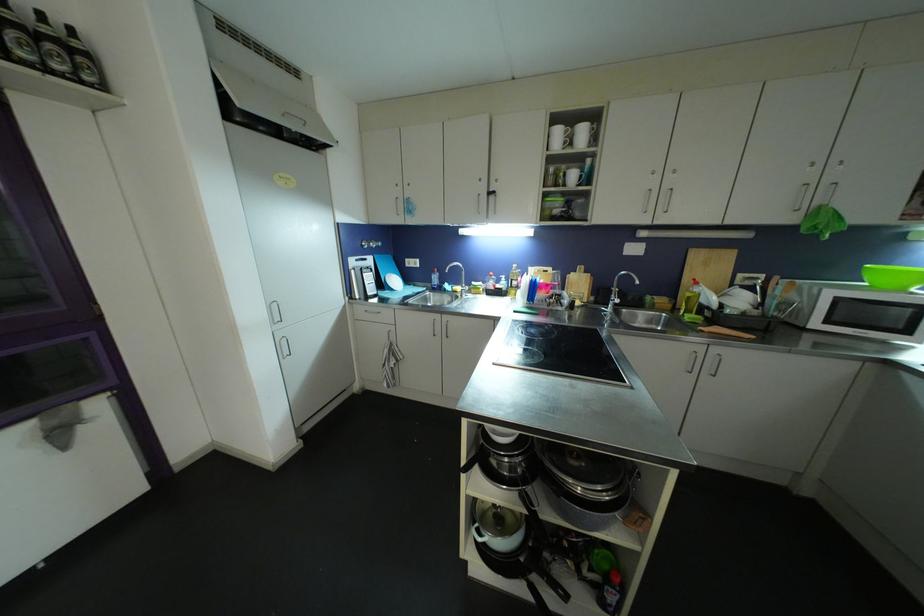
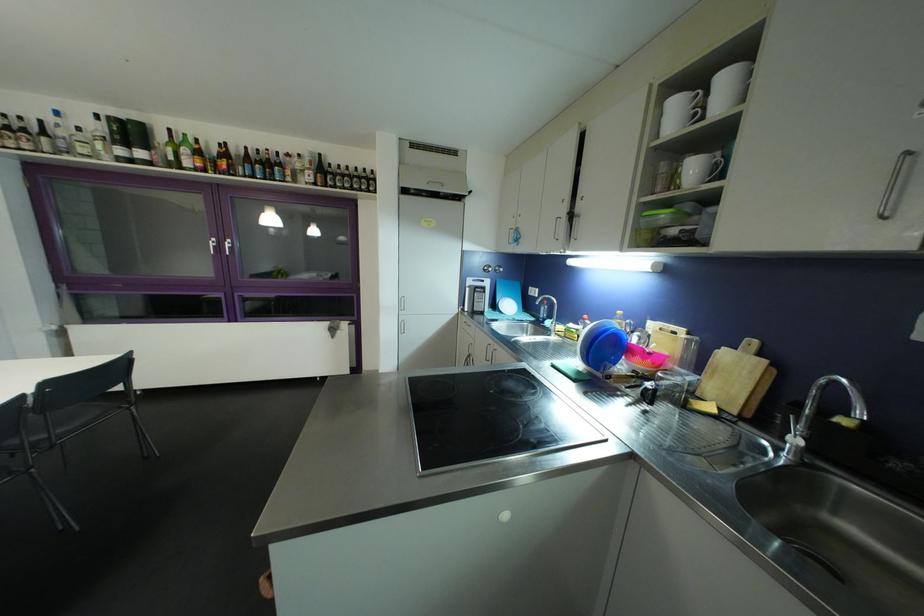
The point at [397,347] is marked in the first image. Where is the corresponding point in the second image?

(476, 359)